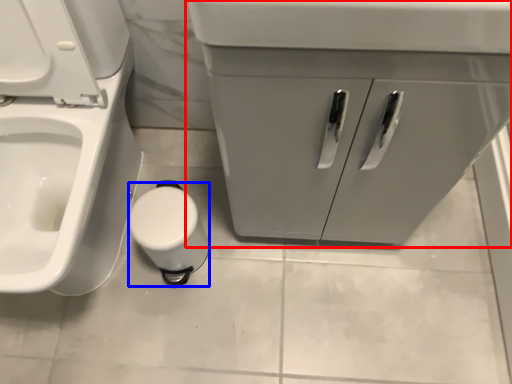
Question: Which point is closer to the camera, bathroom cabinet (highlighted by a red box) or toilet paper (highlighted by a blue box)?

Choices:
 (A) bathroom cabinet
 (B) toilet paper

Answer: (A)